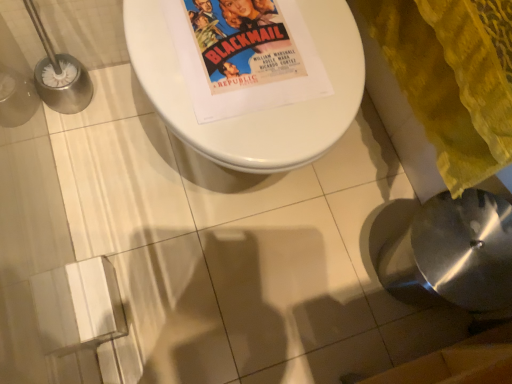
Find the location of a particular element. Image resolution: width=512 pixels, height=384 pixels. yellow textured blanket at lower right is located at coordinates (399, 119).

Image resolution: width=512 pixels, height=384 pixels. I want to click on satin silver sink at lower right, so click(x=455, y=253).

You are a GUI agent. You are given a task and a screenshot of the screen. Output one action in this format:
    pyautogui.click(x=<x>, y=<y>)
    Task: Click on the white glossy toilet at center
    The height and width of the screenshot is (384, 512).
    Given the screenshot: What is the action you would take?
    pyautogui.click(x=258, y=111)

Find the location of a particular element. This screenshot has height=384, width=512. yellow textured blanket at lower right is located at coordinates (399, 119).

Are yellow textured blanket at lower right and satin silver sink at lower right located far from each other?

That's not correct — yellow textured blanket at lower right is a little close to satin silver sink at lower right.

How different are the orientations of yellow textured blanket at lower right and satin silver sink at lower right in degrees?

The facing directions of yellow textured blanket at lower right and satin silver sink at lower right are 2.07 degrees apart.

Does yellow textured blanket at lower right have a greater height compared to satin silver sink at lower right?

In fact, yellow textured blanket at lower right may be shorter than satin silver sink at lower right.

Is yellow textured blanket at lower right looking in the opposite direction of satin silver sink at lower right?

yellow textured blanket at lower right is not turned away from satin silver sink at lower right.

Considering the sizes of yellow textured blanket at lower right and white glossy toilet at center in the image, is yellow textured blanket at lower right bigger or smaller than white glossy toilet at center?

yellow textured blanket at lower right is smaller than white glossy toilet at center.

Is yellow textured blanket at lower right looking in the opposite direction of white glossy toilet at center?

No, white glossy toilet at center is not at the back of yellow textured blanket at lower right.

Consider the image. From a real-world perspective, who is located higher, yellow textured blanket at lower right or white glossy toilet at center?

In real-world perspective, yellow textured blanket at lower right is above.

Does point (390, 124) appear closer or farther from the camera than point (321, 3)?

Clearly, point (390, 124) is more distant from the camera than point (321, 3).

Can we say satin silver sink at lower right lies outside white glossy toilet at center?

Yes, satin silver sink at lower right is not within white glossy toilet at center.

Is satin silver sink at lower right at the left side of white glossy toilet at center?

No, satin silver sink at lower right is not to the left of white glossy toilet at center.

Can you confirm if satin silver sink at lower right is taller than white glossy toilet at center?

Indeed, satin silver sink at lower right has a greater height compared to white glossy toilet at center.

Considering the relative sizes of white glossy toilet at center and satin silver sink at lower right in the image provided, is white glossy toilet at center wider than satin silver sink at lower right?

Yes, white glossy toilet at center is wider than satin silver sink at lower right.

Are white glossy toilet at center and satin silver sink at lower right beside each other?

white glossy toilet at center is not next to satin silver sink at lower right, and they're not touching.

From the picture: From the image's perspective, is white glossy toilet at center located above or below satin silver sink at lower right?

Based on their image positions, white glossy toilet at center is located above satin silver sink at lower right.

Measure the distance from white glossy toilet at center to satin silver sink at lower right.

The distance of white glossy toilet at center from satin silver sink at lower right is 38.97 centimeters.

Is satin silver sink at lower right bigger or smaller than yellow textured blanket at lower right?

Clearly, satin silver sink at lower right is smaller in size than yellow textured blanket at lower right.

Based on their positions, is satin silver sink at lower right located to the left or right of yellow textured blanket at lower right?

Result: From the image, it's evident that satin silver sink at lower right is to the right of yellow textured blanket at lower right.

From a real-world perspective, relative to yellow textured blanket at lower right, is satin silver sink at lower right vertically above or below?

In terms of real-world spatial position, satin silver sink at lower right is below yellow textured blanket at lower right.

Is satin silver sink at lower right positioned beyond the bounds of yellow textured blanket at lower right?

Absolutely, satin silver sink at lower right is external to yellow textured blanket at lower right.

Looking at this image, is white glossy toilet at center directly adjacent to yellow textured blanket at lower right?

white glossy toilet at center is not next to yellow textured blanket at lower right, and they're not touching.

Which is correct: white glossy toilet at center is inside yellow textured blanket at lower right, or outside of it?

white glossy toilet at center cannot be found inside yellow textured blanket at lower right.

From the image's perspective, does white glossy toilet at center appear higher than yellow textured blanket at lower right?

Actually, white glossy toilet at center appears below yellow textured blanket at lower right in the image.

Locate an element on the screen. This screenshot has width=512, height=384. blanket above the satin silver sink at lower right (from the image's perspective) is located at coordinates (399, 119).

Where is `blanket above the white glossy toilet at center (from a real-world perspective)`? This screenshot has height=384, width=512. blanket above the white glossy toilet at center (from a real-world perspective) is located at coordinates (399, 119).

Looking at the image, which one is located closer to yellow textured blanket at lower right, white glossy toilet at center or satin silver sink at lower right?

satin silver sink at lower right is closer to yellow textured blanket at lower right.

Considering their positions, is yellow textured blanket at lower right positioned further to satin silver sink at lower right than white glossy toilet at center?

white glossy toilet at center is positioned further to the anchor satin silver sink at lower right.

Looking at the image, which one is located further to satin silver sink at lower right, white glossy toilet at center or yellow textured blanket at lower right?

white glossy toilet at center is further to satin silver sink at lower right.

Based on the photo, based on their spatial positions, is satin silver sink at lower right or white glossy toilet at center further from yellow textured blanket at lower right?

white glossy toilet at center is further to yellow textured blanket at lower right.

Considering their positions, is yellow textured blanket at lower right positioned closer to white glossy toilet at center than satin silver sink at lower right?

satin silver sink at lower right is closer to white glossy toilet at center.

From the image, which object appears to be nearer to white glossy toilet at center, satin silver sink at lower right or yellow textured blanket at lower right?

satin silver sink at lower right is positioned closer to the anchor white glossy toilet at center.

I want to click on toilet between yellow textured blanket at lower right and satin silver sink at lower right from top to bottom, so click(258, 111).